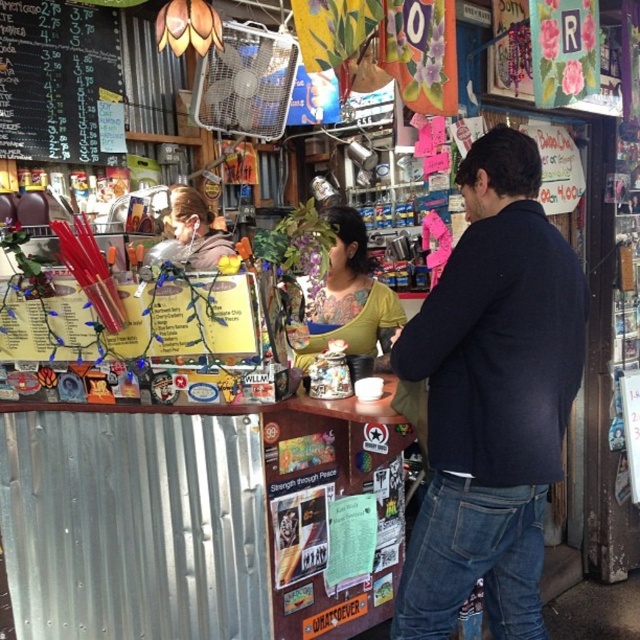
Question: Which is nearer to the black chalkboard menu at upper left?

Choices:
 (A) dark blue sweater at center
 (B) matte black hair at center
 (C) yellow matte shirt at center

Answer: (B)

Question: Does black chalkboard menu at upper left have a larger size compared to yellow matte shirt at center?

Choices:
 (A) yes
 (B) no

Answer: (A)

Question: Which of the following is the farthest from the observer?

Choices:
 (A) (326, 285)
 (B) (198, 211)

Answer: (B)

Question: Which of the following is the farthest from the observer?

Choices:
 (A) [508, 337]
 (B) [38, 140]
 (C) [317, 316]

Answer: (B)

Question: Is black chalkboard menu at upper left further to the viewer compared to yellow matte shirt at center?

Choices:
 (A) yes
 (B) no

Answer: (A)

Question: Is black chalkboard menu at upper left positioned behind matte black hair at center?

Choices:
 (A) no
 (B) yes

Answer: (B)